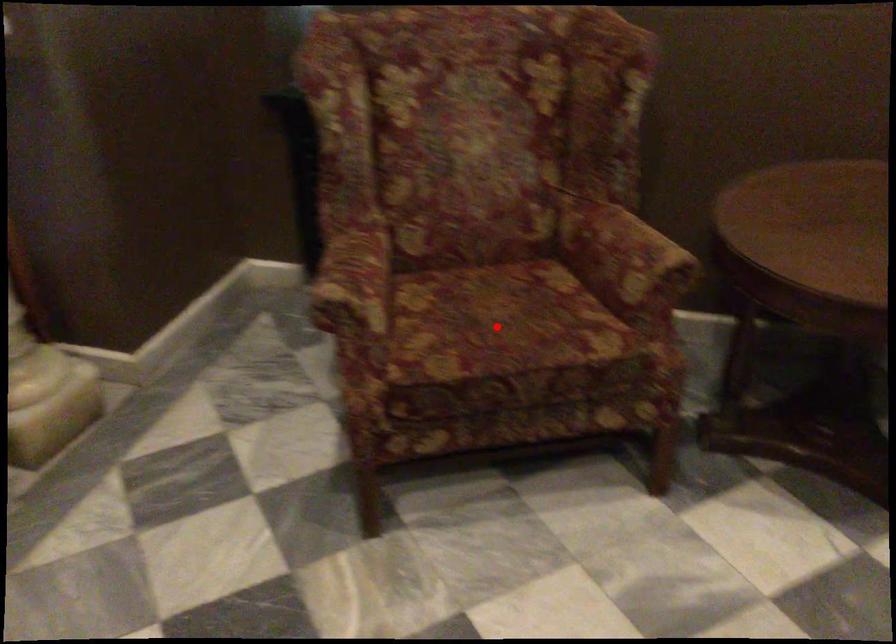
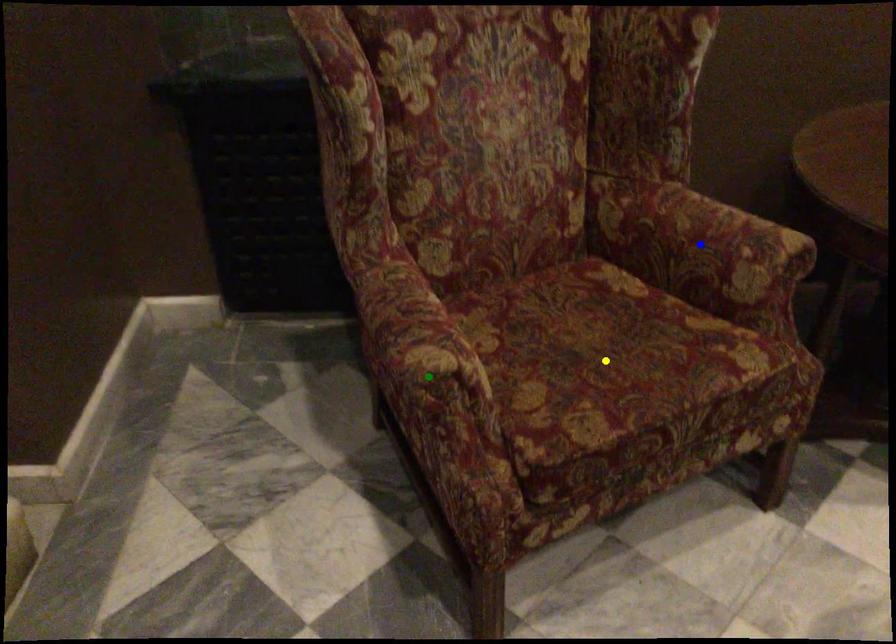
Question: I am providing you with two images of the same scene from different viewpoints. A red point is marked on the first image. You are given multiple points on the second image. In image 2, which mark is for the same physical point as the one in image 1?

Choices:
 (A) blue point
 (B) green point
 (C) yellow point

Answer: (C)